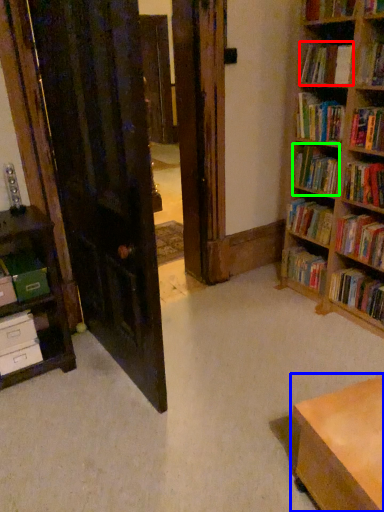
Question: Considering the real-world distances, which object is closest to book (highlighted by a red box)? table (highlighted by a blue box) or book (highlighted by a green box).

Choices:
 (A) table
 (B) book

Answer: (B)